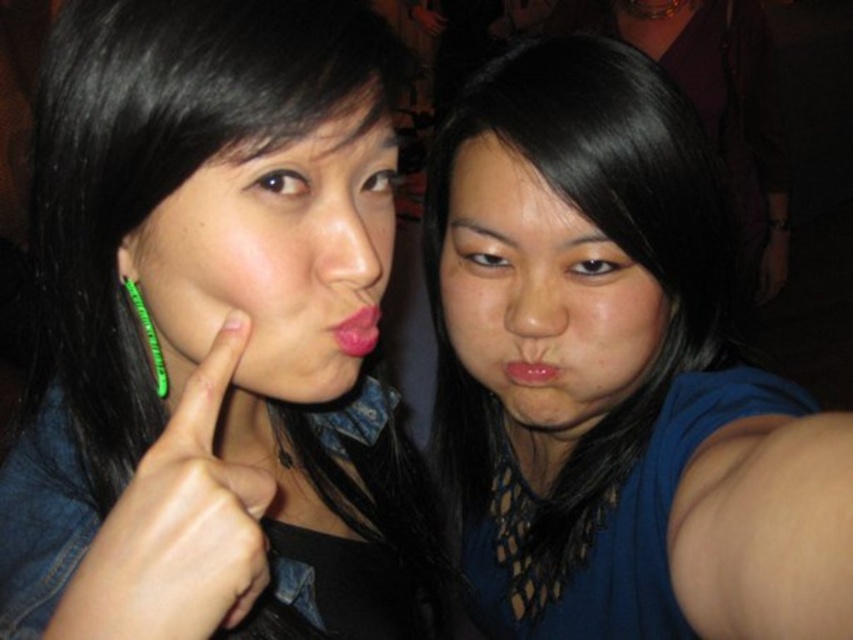
Between point (71, 346) and point (550, 365), which one is positioned behind?

Positioned behind is point (550, 365).

Can you confirm if matte black hair at left is positioned below pink matte lips at center?

Yes.

Find the location of a particular element. This screenshot has height=640, width=853. matte black hair at left is located at coordinates (213, 333).

The image size is (853, 640). Find the location of `matte black hair at left`. matte black hair at left is located at coordinates click(213, 333).

In the scene shown: Between green plastic ring at upper left and matte pink lips at center, which one is positioned lower?

Positioned lower is green plastic ring at upper left.

Which is behind, point (119, 637) or point (368, 349)?

Point (368, 349)

Is point (198, 532) positioned behind point (354, 330)?

That is False.

You are a GUI agent. You are given a task and a screenshot of the screen. Output one action in this format:
    pyautogui.click(x=<x>, y=<y>)
    Task: Click on the green plastic ring at upper left
    
    Given the screenshot: What is the action you would take?
    pyautogui.click(x=177, y=528)

Measure the distance between point (x=485, y=348) and camera.

Point (x=485, y=348) is 25.23 inches from camera.

Who is taller, blue fabric shirt at center or pink matte lips at center?

Result: With more height is blue fabric shirt at center.

At what (x,y) coordinates should I click in order to perform the action: click on blue fabric shirt at center. Please return your answer as a coordinate pair (x, y). The width and height of the screenshot is (853, 640). Looking at the image, I should click on (614, 371).